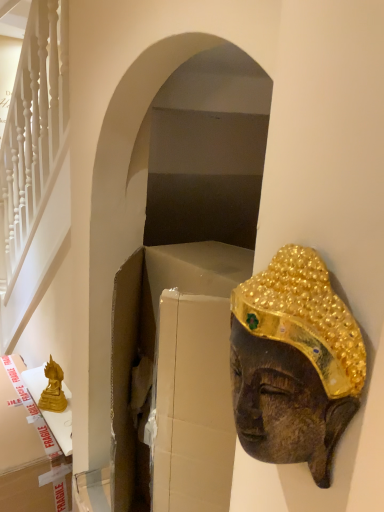
Question: From a real-world perspective, is gold textured mask at right positioned above or below gold matte statue at lower left?

Choices:
 (A) below
 (B) above

Answer: (B)

Question: In the image, is gold textured mask at right positioned in front of or behind gold matte statue at lower left?

Choices:
 (A) behind
 (B) front

Answer: (B)

Question: Based on their relative distances, which object is nearer to the gold cardboard box at left?

Choices:
 (A) gold matte statue at lower left
 (B) gold textured mask at right

Answer: (A)

Question: Estimate the real-world distances between objects in this image. Which object is farther from the gold textured mask at right?

Choices:
 (A) gold cardboard box at left
 (B) gold matte statue at lower left

Answer: (B)